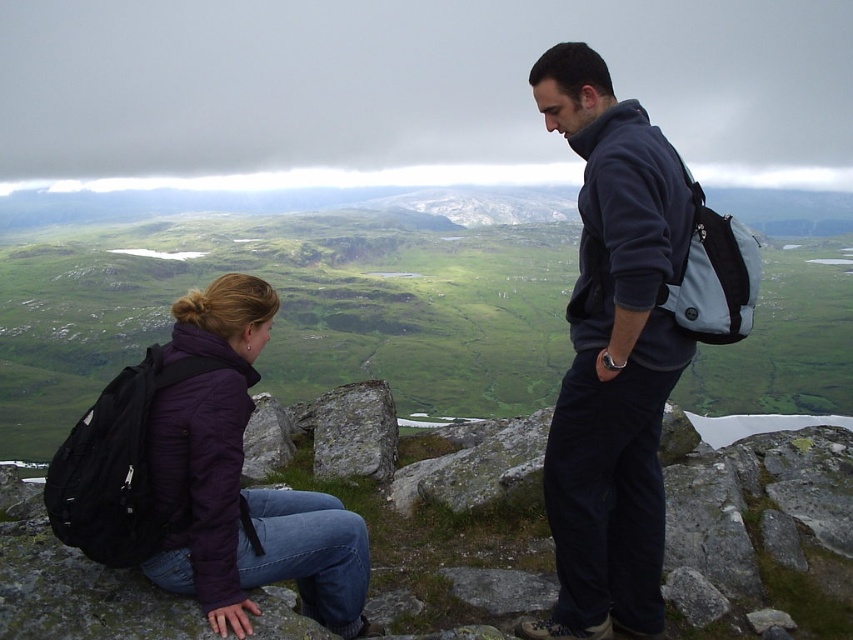
From the picture: You are a hiker trying to decide whether to place your water bottle between the purple matte jacket at lower left and the gray rough rock at center. Given that the water bottle is 15 cm wide, can you fit it there?

The purple matte jacket at lower left is wider than the gray rough rock at center. Since the water bottle is 15 cm wide, you need to check the available space between them. However, the exact distance between the two objects isn

You are a hiker trying to locate your friend who is wearing a dark blue fleece jacket at center. Based on the coordinates provided, where should you look to find them in the rocky outcrop?

The dark blue fleece jacket at center is located at point coordinates (612, 355), so you should look towards the center area of the image where those coordinates point to find your friend wearing it.

You are standing at the point marked as point [599,401] and want to walk to the edge of the rocky outcrop. The edge is 10 meters away from you. Can you reach the edge without walking more than 10 meters?

The distance between point [599,401] and the viewer is 9.25 meters, so yes, you can reach the edge without exceeding 10 meters since 9.25 is less than 10.